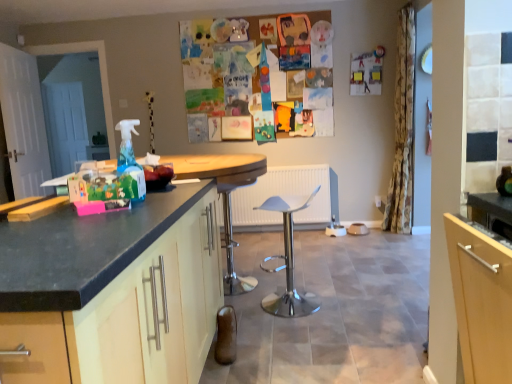
The width and height of the screenshot is (512, 384). I want to click on vacant space behind white glossy swivel chair at center, so click(297, 283).